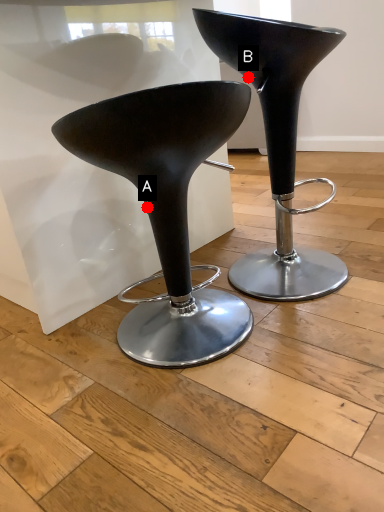
Question: Two points are circled on the image, labeled by A and B beside each circle. Which point is further to the camera?

Choices:
 (A) A is further
 (B) B is further

Answer: (B)